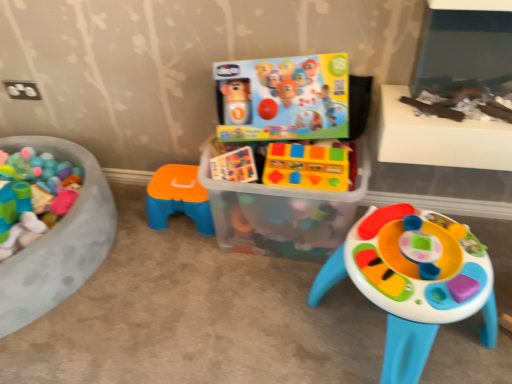
Question: Is plastic colorful activity table at center, the third toy in the left-to-right sequence, looking in the opposite direction of translucent plastic container at center?

Choices:
 (A) no
 (B) yes

Answer: (A)

Question: Is translucent plastic container at center completely or partially inside plastic colorful activity table at center, the third toy in the left-to-right sequence?

Choices:
 (A) no
 (B) yes

Answer: (A)

Question: Is plastic colorful activity table at center, arranged as the first toy when viewed from the right, positioned far away from translucent plastic container at center?

Choices:
 (A) no
 (B) yes

Answer: (A)

Question: Does plastic colorful activity table at center, the third toy in the left-to-right sequence, have a smaller size compared to translucent plastic container at center?

Choices:
 (A) yes
 (B) no

Answer: (B)

Question: Is plastic colorful activity table at center, arranged as the first toy when viewed from the right, touching translucent plastic container at center?

Choices:
 (A) no
 (B) yes

Answer: (A)

Question: Considering the relative sizes of plastic colorful activity table at center, arranged as the first toy when viewed from the right, and translucent plastic container at center in the image provided, is plastic colorful activity table at center, arranged as the first toy when viewed from the right, thinner than translucent plastic container at center?

Choices:
 (A) yes
 (B) no

Answer: (B)

Question: From the image's perspective, is white plastic table at upper right over translucent plastic container at center?

Choices:
 (A) yes
 (B) no

Answer: (A)

Question: Is white plastic table at upper right in front of translucent plastic container at center?

Choices:
 (A) yes
 (B) no

Answer: (A)

Question: Does white plastic table at upper right have a lesser width compared to translucent plastic container at center?

Choices:
 (A) no
 (B) yes

Answer: (B)

Question: From the image's perspective, is white plastic table at upper right located beneath translucent plastic container at center?

Choices:
 (A) no
 (B) yes

Answer: (A)

Question: Considering the relative sizes of white plastic table at upper right and translucent plastic container at center in the image provided, is white plastic table at upper right bigger than translucent plastic container at center?

Choices:
 (A) yes
 (B) no

Answer: (B)

Question: Is white plastic table at upper right completely or partially outside of translucent plastic container at center?

Choices:
 (A) no
 (B) yes

Answer: (B)

Question: From a real-world perspective, is yellow plastic toy blocks at center, arranged as the second toy when viewed from the right, physically below orange plastic stool at center, the third toy when ordered from right to left?

Choices:
 (A) no
 (B) yes

Answer: (A)